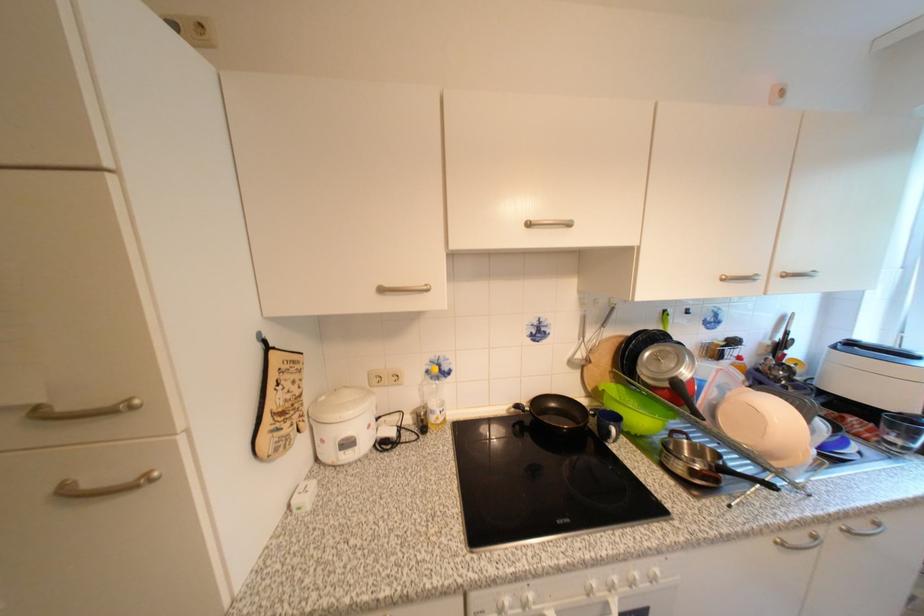
At what (x,y) coordinates should I click in order to perform the action: click on metal lid handle. Please return your answer as a coordinate pair (x, y). This screenshot has width=924, height=616. Looking at the image, I should click on (103, 487).